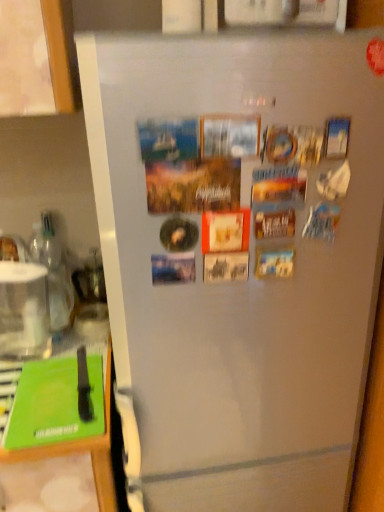
Question: Is clear glass water at left shorter than green plastic cutting board at lower left?

Choices:
 (A) yes
 (B) no

Answer: (A)

Question: Is clear glass water at left behind green plastic cutting board at lower left?

Choices:
 (A) no
 (B) yes

Answer: (B)

Question: Considering the relative sizes of clear glass water at left and green plastic cutting board at lower left in the image provided, is clear glass water at left smaller than green plastic cutting board at lower left?

Choices:
 (A) no
 (B) yes

Answer: (B)

Question: Is clear glass water at left aimed at green plastic cutting board at lower left?

Choices:
 (A) no
 (B) yes

Answer: (A)

Question: Is clear glass water at left at the right side of green plastic cutting board at lower left?

Choices:
 (A) no
 (B) yes

Answer: (B)

Question: Is clear glass water at left positioned far away from green plastic cutting board at lower left?

Choices:
 (A) no
 (B) yes

Answer: (A)

Question: From the image's perspective, is green matte magazine at lower left on top of clear glass water at left?

Choices:
 (A) no
 (B) yes

Answer: (A)

Question: Is green matte magazine at lower left surrounding clear glass water at left?

Choices:
 (A) yes
 (B) no

Answer: (B)

Question: Is green matte magazine at lower left shorter than clear glass water at left?

Choices:
 (A) no
 (B) yes

Answer: (B)

Question: Can you confirm if green matte magazine at lower left is positioned to the right of clear glass water at left?

Choices:
 (A) no
 (B) yes

Answer: (B)

Question: From a real-world perspective, is green matte magazine at lower left under clear glass water at left?

Choices:
 (A) no
 (B) yes

Answer: (B)

Question: Is green matte magazine at lower left positioned in front of clear glass water at left?

Choices:
 (A) yes
 (B) no

Answer: (A)

Question: Considering the relative sizes of green plastic cutting board at lower left and clear glass water at left in the image provided, is green plastic cutting board at lower left bigger than clear glass water at left?

Choices:
 (A) yes
 (B) no

Answer: (A)